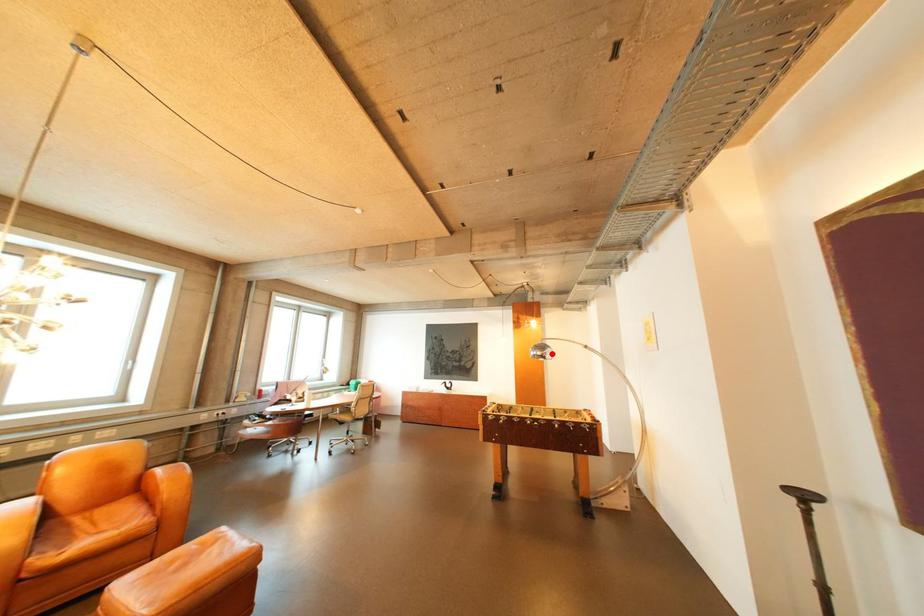
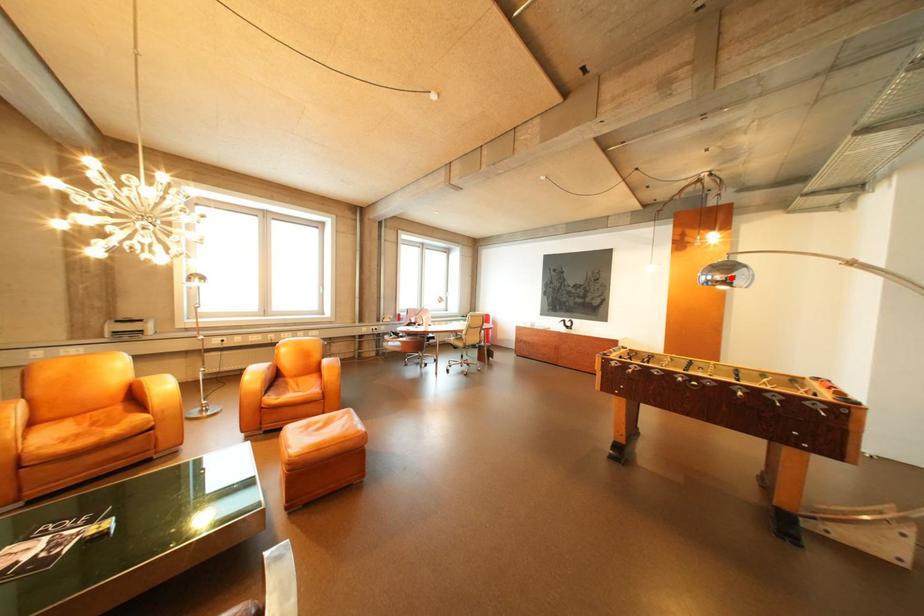
I am providing you with two images of the same scene from different viewpoints. A red point is marked on the first image and another point is marked on the second image. Does the point marked in image1 correspond to the same location as the one in image2?

Yes